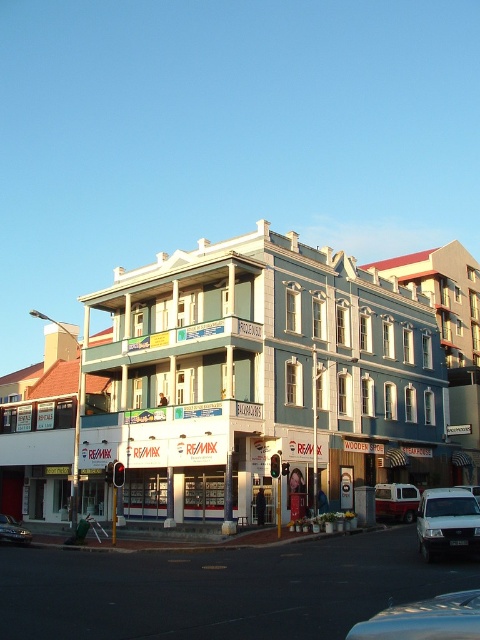
You are a delivery person trying to park your white matte van at lower right near the RE MAX real estate store on the ground floor. Based on the scene description, can you park your van directly in front of the RE MAX store?

The white matte van at lower right is located at point (447, 522), which is at the lower right of the image. The RE MAX store is on the ground floor, but the van is positioned at the lower right, so it might not be directly in front of the RE MAX store unless the store is also at the lower right. However, the scene mentions the RE MAX is one of the storefronts on the ground floor, but doesn not specify its exact location. Therefore, without more precise information, it is uncertain if the van can be parkd

Please provide the coordinates of the white painted building at center in the image. The coordinate system is normalized such that the bottom left corner is the origin point and the top right corner is the maximum point. The coordinates should be in the format of a tuple with two decimal numbers, like this example format of a coordinate point in the image coordinate system. The first number is the x coordinate and the second number is the y coordinate. The coordinate system is normalized between 0 and 1. 0,

The coordinates of the white painted building at center are at point 0.602 in the x axis and 0.494 in the y axis. So the coordinate is (x=237, y=385).

You are a delivery person who needs to park your vehicle in the parking lot near the RE MAX building. You have a large truck that is 12 meters long. Can you safely park your truck between the metallic silver van at center and the shiny silver car at lower left without overlapping either vehicle?

The distance between the metallic silver van at center and the shiny silver car at lower left is 26.87 meters. Since your truck is only 12 meters long, there is sufficient space to park between them without overlapping either vehicle.